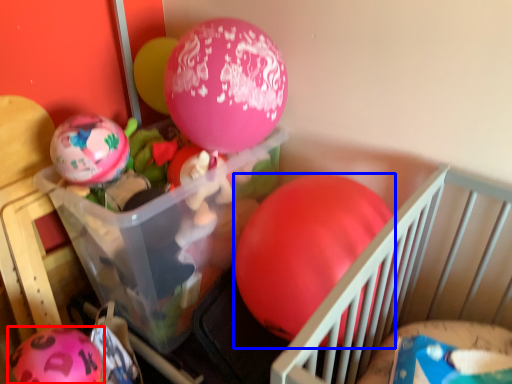
Question: Which point is further to the camera, balloon (highlighted by a red box) or balloon (highlighted by a blue box)?

Choices:
 (A) balloon
 (B) balloon

Answer: (A)